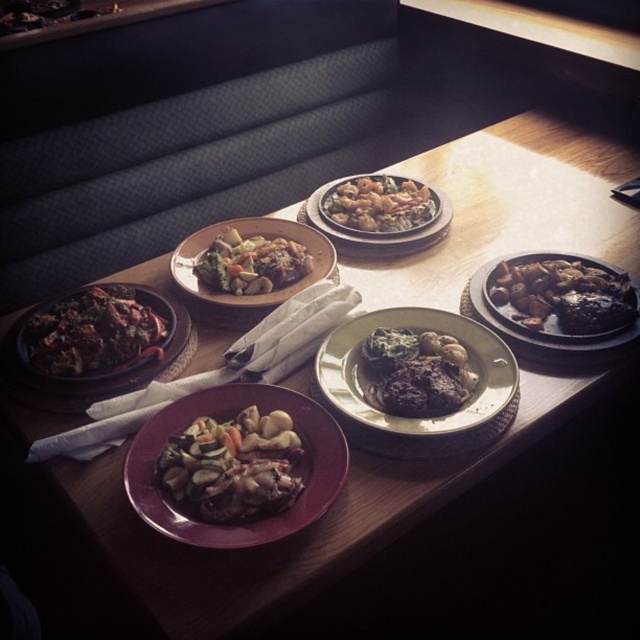
Question: Is shiny brown meat at center to the right of shiny metallic bowl at center from the viewer's perspective?

Choices:
 (A) no
 (B) yes

Answer: (B)

Question: Which of the following is the farthest from the observer?

Choices:
 (A) green matte plate at center
 (B) shiny metallic bowl at center
 (C) shiny dark brown meat at right
 (D) shiny metallic plate at center

Answer: (D)

Question: Is shiny brown mushrooms at center wider than shiny metallic plate at center?

Choices:
 (A) no
 (B) yes

Answer: (A)

Question: Does green matte plate at center have a larger size compared to matte ceramic plate at center?

Choices:
 (A) no
 (B) yes

Answer: (B)

Question: Which point is closer to the camera taking this photo?

Choices:
 (A) (276, 400)
 (B) (449, 400)
 (C) (115, 304)

Answer: (B)

Question: Considering the real-world distances, which object is farthest from the green matte plate at center?

Choices:
 (A) matte ceramic plate at center
 (B) shiny metallic bowl at center
 (C) shiny dark brown meat at right
 (D) dark brown glossy meat at left

Answer: (D)